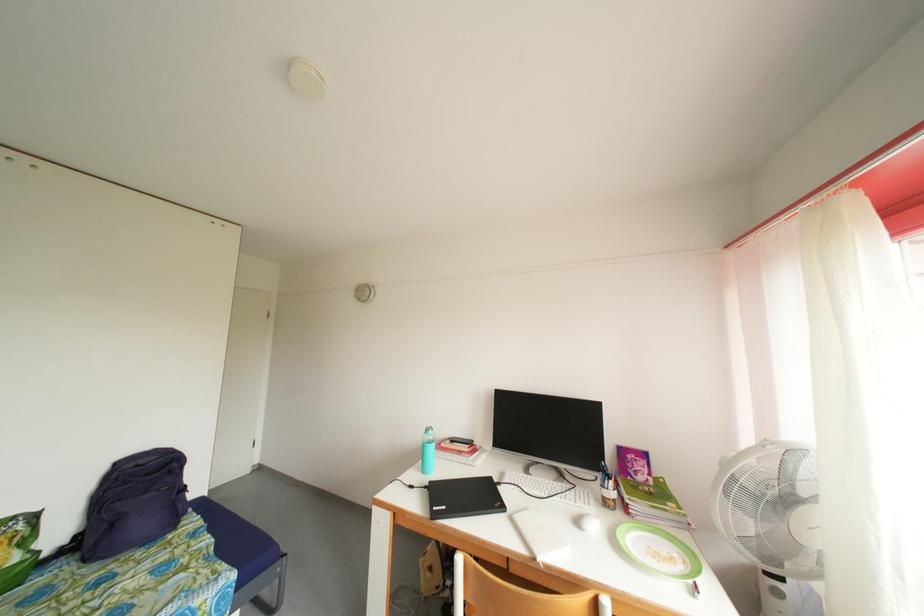
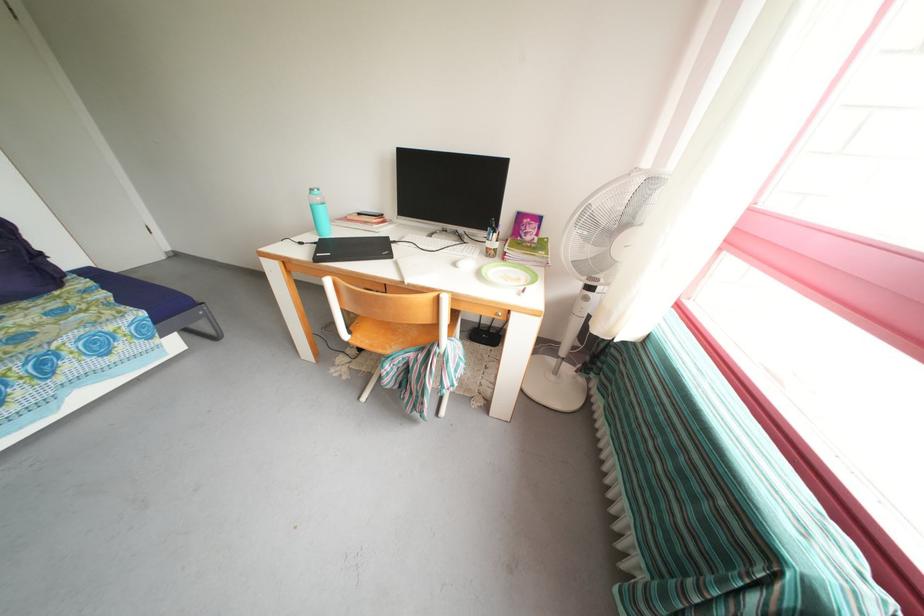
Find the pixel in the second image that matches the point at 585,528 in the first image.

(462, 269)